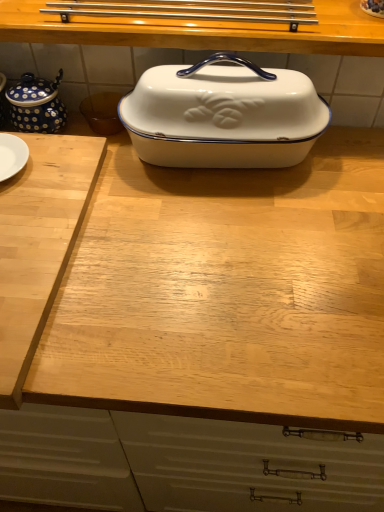
Where is `blue dotted ceramic tea pot at left`? This screenshot has width=384, height=512. blue dotted ceramic tea pot at left is located at coordinates (36, 104).

What do you see at coordinates (36, 104) in the screenshot?
I see `blue dotted ceramic tea pot at left` at bounding box center [36, 104].

Describe the element at coordinates (223, 116) in the screenshot. I see `white enamel casserole dish at center` at that location.

The width and height of the screenshot is (384, 512). What are the coordinates of `light wood cutting board at left` in the screenshot? It's located at (39, 243).

Is white enamel casserole dish at center positioned in front of blue dotted ceramic tea pot at left?

Yes, white enamel casserole dish at center is in front of blue dotted ceramic tea pot at left.

Is white enamel casserole dish at center far from blue dotted ceramic tea pot at left?

Actually, white enamel casserole dish at center and blue dotted ceramic tea pot at left are a little close together.

Is white enamel casserole dish at center surrounding blue dotted ceramic tea pot at left?

No, blue dotted ceramic tea pot at left is not a part of white enamel casserole dish at center.

From the image's perspective, relative to white glossy enamel dish at center, is blue dotted ceramic tea pot at left above or below?

Based on their image positions, blue dotted ceramic tea pot at left is located beneath white glossy enamel dish at center.

Which of these two, blue dotted ceramic tea pot at left or white glossy enamel dish at center, stands taller?

Standing taller between the two is blue dotted ceramic tea pot at left.

Is blue dotted ceramic tea pot at left closer to the viewer compared to white glossy enamel dish at center?

No, blue dotted ceramic tea pot at left is behind white glossy enamel dish at center.

Is blue dotted ceramic tea pot at left touching white glossy enamel dish at center?

No, blue dotted ceramic tea pot at left is not touching white glossy enamel dish at center.

Does white glossy enamel dish at center appear on the right side of white enamel casserole dish at center?

No, white glossy enamel dish at center is not to the right of white enamel casserole dish at center.

Considering the sizes of white glossy enamel dish at center and white enamel casserole dish at center in the image, is white glossy enamel dish at center taller or shorter than white enamel casserole dish at center?

Clearly, white glossy enamel dish at center is shorter compared to white enamel casserole dish at center.

How far apart are white glossy enamel dish at center and white enamel casserole dish at center?

A distance of 5.45 inches exists between white glossy enamel dish at center and white enamel casserole dish at center.

Is white glossy enamel dish at center bigger or smaller than white enamel casserole dish at center?

Considering their sizes, white glossy enamel dish at center takes up more space than white enamel casserole dish at center.

Considering the points (25, 233) and (288, 32), which point is in front, point (25, 233) or point (288, 32)?

Positioned in front is point (25, 233).

Would you say light wood cutting board at left is to the left or to the right of white glossy enamel dish at center in the picture?

From the image, it's evident that light wood cutting board at left is to the left of white glossy enamel dish at center.

How different are the orientations of light wood cutting board at left and white glossy enamel dish at center in degrees?

The angular difference between light wood cutting board at left and white glossy enamel dish at center is 1.66 degrees.

Between light wood cutting board at left and white glossy enamel dish at center, which one has more height?

Standing taller between the two is white glossy enamel dish at center.

Which is less distant, (368, 10) or (233, 83)?

Point (368, 10) appears to be farther away from the viewer than point (233, 83).

How distant is blue polka dot ceramic jar at upper left from white enamel casserole dish at center?

A distance of 14.24 inches exists between blue polka dot ceramic jar at upper left and white enamel casserole dish at center.

How many degrees apart are the facing directions of blue polka dot ceramic jar at upper left and white enamel casserole dish at center?

blue polka dot ceramic jar at upper left and white enamel casserole dish at center are facing 1.49 degrees away from each other.

Is blue polka dot ceramic jar at upper left oriented away from white enamel casserole dish at center?

No, white enamel casserole dish at center is not at the back of blue polka dot ceramic jar at upper left.

Looking at their sizes, would you say white glossy enamel dish at center is wider or thinner than blue dotted ceramic tea pot at left?

white glossy enamel dish at center is wider than blue dotted ceramic tea pot at left.

Considering the points (105, 38) and (61, 127), which point is behind, point (105, 38) or point (61, 127)?

The point (61, 127) is farther from the camera.

What's the angular difference between white glossy enamel dish at center and blue dotted ceramic tea pot at left's facing directions?

white glossy enamel dish at center and blue dotted ceramic tea pot at left are facing 1.66 degrees away from each other.

Does white glossy enamel dish at center appear on the right side of blue dotted ceramic tea pot at left?

Indeed, white glossy enamel dish at center is positioned on the right side of blue dotted ceramic tea pot at left.

Does light wood cutting board at left contain white enamel casserole dish at center?

No, white enamel casserole dish at center is not surrounded by light wood cutting board at left.

From the image's perspective, which one is positioned lower, light wood cutting board at left or white enamel casserole dish at center?

light wood cutting board at left is shown below in the image.

Considering the sizes of objects light wood cutting board at left and white enamel casserole dish at center in the image provided, who is bigger, light wood cutting board at left or white enamel casserole dish at center?

With larger size is white enamel casserole dish at center.

From a real-world perspective, is light wood cutting board at left physically located above or below white enamel casserole dish at center?

light wood cutting board at left is below white enamel casserole dish at center.

Where is `kitchen appliance positioned vertically above the blue dotted ceramic tea pot at left (from a real-world perspective)`? Image resolution: width=384 pixels, height=512 pixels. kitchen appliance positioned vertically above the blue dotted ceramic tea pot at left (from a real-world perspective) is located at coordinates (223, 116).

Locate an element on the screen. tea pot on the left of white glossy enamel dish at center is located at coordinates (36, 104).

Which object lies further to the anchor point white glossy enamel dish at center, blue polka dot ceramic jar at upper left or blue dotted ceramic tea pot at left?

Among the two, blue polka dot ceramic jar at upper left is located further to white glossy enamel dish at center.

Which object lies nearer to the anchor point white enamel casserole dish at center, light wood cutting board at left or blue dotted ceramic tea pot at left?

light wood cutting board at left is positioned closer to the anchor white enamel casserole dish at center.

In the scene shown: Estimate the real-world distances between objects in this image. Which object is further from blue polka dot ceramic jar at upper left, blue dotted ceramic tea pot at left or white enamel casserole dish at center?

blue dotted ceramic tea pot at left lies further to blue polka dot ceramic jar at upper left than the other object.

Based on their spatial positions, is blue dotted ceramic tea pot at left or blue polka dot ceramic jar at upper left further from white enamel casserole dish at center?

blue polka dot ceramic jar at upper left lies further to white enamel casserole dish at center than the other object.

Based on their spatial positions, is blue polka dot ceramic jar at upper left or white enamel casserole dish at center further from white glossy enamel dish at center?

blue polka dot ceramic jar at upper left.

From the image, which object appears to be nearer to blue dotted ceramic tea pot at left, light wood cutting board at left or blue polka dot ceramic jar at upper left?

light wood cutting board at left.

Based on their spatial positions, is blue polka dot ceramic jar at upper left or light wood cutting board at left further from blue dotted ceramic tea pot at left?

Based on the image, blue polka dot ceramic jar at upper left appears to be further to blue dotted ceramic tea pot at left.

Estimate the real-world distances between objects in this image. Which object is closer to light wood cutting board at left, blue dotted ceramic tea pot at left or white glossy enamel dish at center?

Among the two, blue dotted ceramic tea pot at left is located nearer to light wood cutting board at left.

Locate an element on the screen. The height and width of the screenshot is (512, 384). kitchen appliance between white glossy enamel dish at center and blue polka dot ceramic jar at upper left is located at coordinates (223, 116).

Where is `tea pot between white glossy enamel dish at center and light wood cutting board at left vertically`? The image size is (384, 512). tea pot between white glossy enamel dish at center and light wood cutting board at left vertically is located at coordinates (36, 104).

The width and height of the screenshot is (384, 512). I want to click on countertop located between blue dotted ceramic tea pot at left and blue polka dot ceramic jar at upper left in the left-right direction, so click(x=202, y=31).

I want to click on kitchen appliance between blue dotted ceramic tea pot at left and blue polka dot ceramic jar at upper left, so click(223, 116).